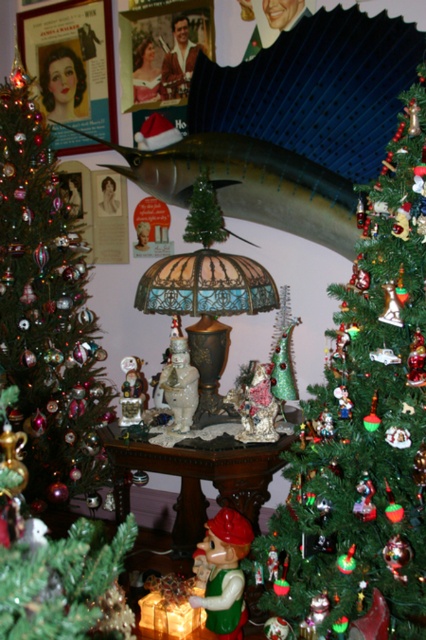
Who is positioned more to the right, green matte christmas tree at center or shiny green christmas tree at left?

From the viewer's perspective, green matte christmas tree at center appears more on the right side.

Is green matte christmas tree at center to the right of shiny green christmas tree at left from the viewer's perspective?

Yes, green matte christmas tree at center is to the right of shiny green christmas tree at left.

Find the location of a particular element. Image resolution: width=426 pixels, height=640 pixels. green matte christmas tree at center is located at coordinates (365, 424).

Is porcelain snowman at center below matte porcelain figurine at center?

Actually, porcelain snowman at center is above matte porcelain figurine at center.

In the scene shown: Which is more to the left, porcelain snowman at center or matte porcelain figurine at center?

matte porcelain figurine at center

The height and width of the screenshot is (640, 426). What are the coordinates of `porcelain snowman at center` in the screenshot? It's located at (180, 385).

Which of these two, green matte christmas tree at center or green matte figurine at lower center, stands shorter?

green matte figurine at lower center is shorter.

Which is below, green matte christmas tree at center or green matte figurine at lower center?

green matte figurine at lower center is lower down.

Between point (409, 326) and point (209, 618), which one is positioned in front?

Point (409, 326) is in front.

The image size is (426, 640). In order to click on green matte christmas tree at center in this screenshot , I will do `click(365, 424)`.